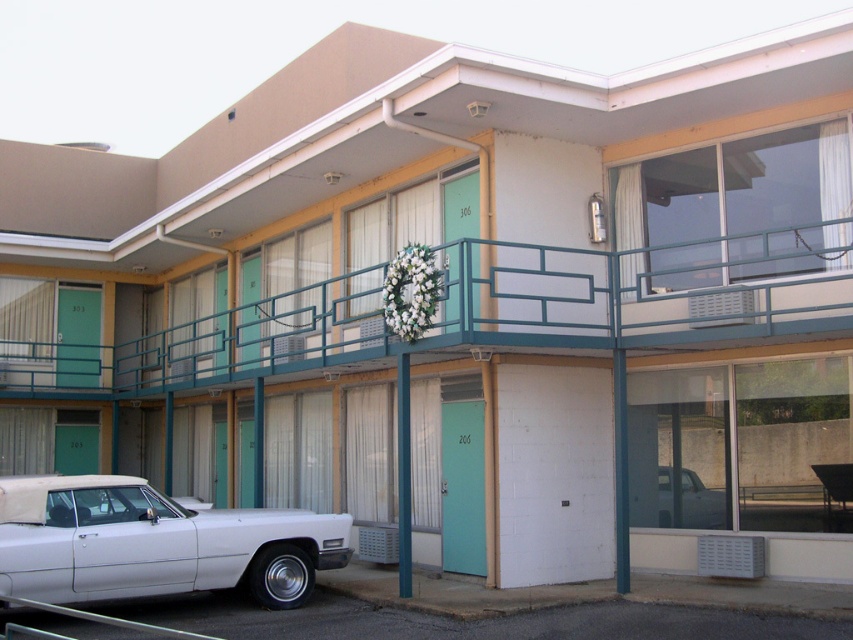
Question: Among these objects, which one is nearest to the camera?

Choices:
 (A) teal metal railing at upper center
 (B) white glossy truck at lower right
 (C) white glossy car at lower left

Answer: (C)

Question: Is teal metal railing at upper center to the right of white glossy car at lower left from the viewer's perspective?

Choices:
 (A) no
 (B) yes

Answer: (B)

Question: Which of the following is the farthest from the observer?

Choices:
 (A) (663, 484)
 (B) (42, 492)

Answer: (A)

Question: Which object appears farthest from the camera in this image?

Choices:
 (A) teal metal railing at upper center
 (B) white glossy car at lower left
 (C) white glossy truck at lower right

Answer: (C)

Question: From the image, what is the correct spatial relationship of teal metal railing at upper center in relation to white glossy truck at lower right?

Choices:
 (A) below
 (B) above

Answer: (B)

Question: Where is teal metal railing at upper center located in relation to white glossy car at lower left in the image?

Choices:
 (A) left
 (B) right

Answer: (B)